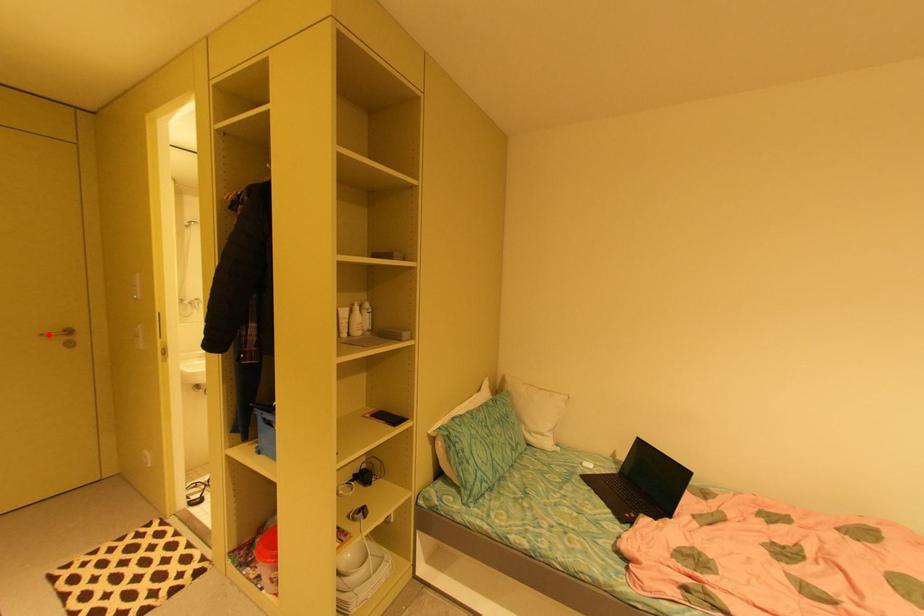
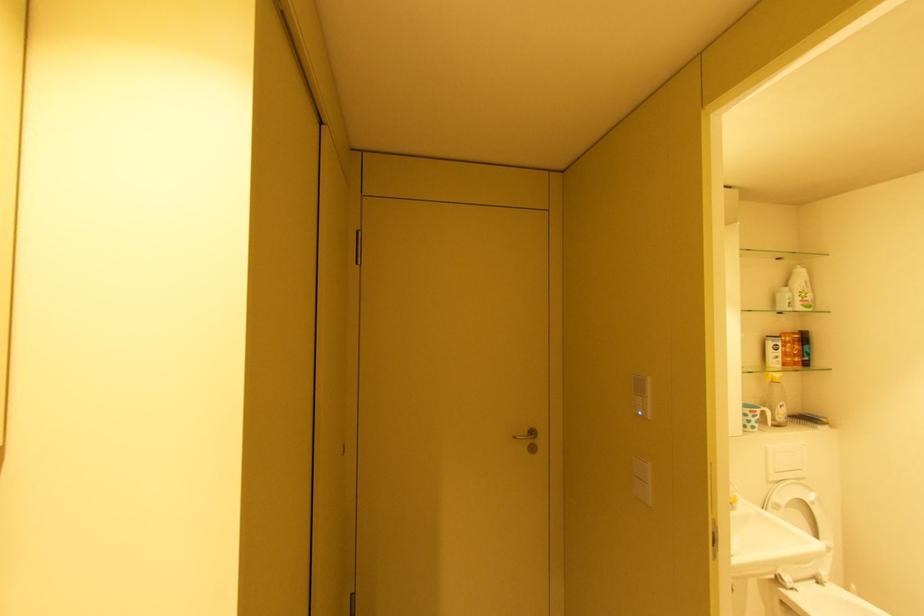
Find the pixel in the second image that matches the highlighted location in the first image.

(520, 438)